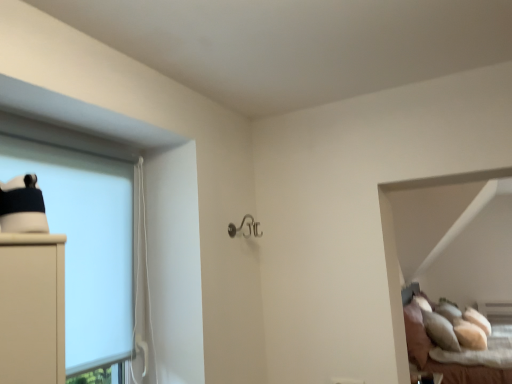
Question: Is white matte cabinet at left closer to the viewer compared to soft beige pillows at lower right?

Choices:
 (A) no
 (B) yes

Answer: (B)

Question: Does white matte cabinet at left have a greater width compared to soft beige pillows at lower right?

Choices:
 (A) yes
 (B) no

Answer: (B)

Question: Is white matte cabinet at left positioned behind soft beige pillows at lower right?

Choices:
 (A) yes
 (B) no

Answer: (B)

Question: Can you confirm if white matte cabinet at left is shorter than soft beige pillows at lower right?

Choices:
 (A) yes
 (B) no

Answer: (A)

Question: Is white matte cabinet at left facing away from soft beige pillows at lower right?

Choices:
 (A) no
 (B) yes

Answer: (A)

Question: Is white matte cabinet at left not inside soft beige pillows at lower right?

Choices:
 (A) yes
 (B) no

Answer: (A)

Question: Is white matte cabinet at left completely or partially inside soft beige pillows at lower right?

Choices:
 (A) no
 (B) yes

Answer: (A)

Question: From the image's perspective, is soft beige pillows at lower right above white matte cabinet at left?

Choices:
 (A) no
 (B) yes

Answer: (A)

Question: Can you confirm if soft beige pillows at lower right is wider than white matte cabinet at left?

Choices:
 (A) yes
 (B) no

Answer: (A)

Question: Is soft beige pillows at lower right positioned far away from white matte cabinet at left?

Choices:
 (A) yes
 (B) no

Answer: (A)

Question: Is soft beige pillows at lower right at the right side of white matte cabinet at left?

Choices:
 (A) yes
 (B) no

Answer: (A)

Question: Could you tell me if soft beige pillows at lower right is turned towards white matte cabinet at left?

Choices:
 (A) yes
 (B) no

Answer: (B)

Question: In the image, is soft beige pillows at lower right positioned in front of or behind white matte cabinet at left?

Choices:
 (A) front
 (B) behind

Answer: (B)